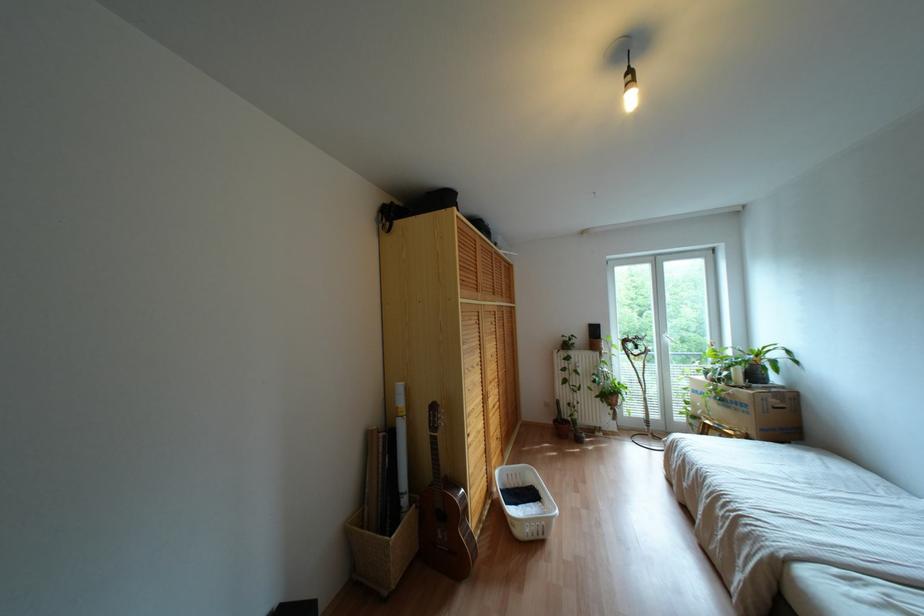
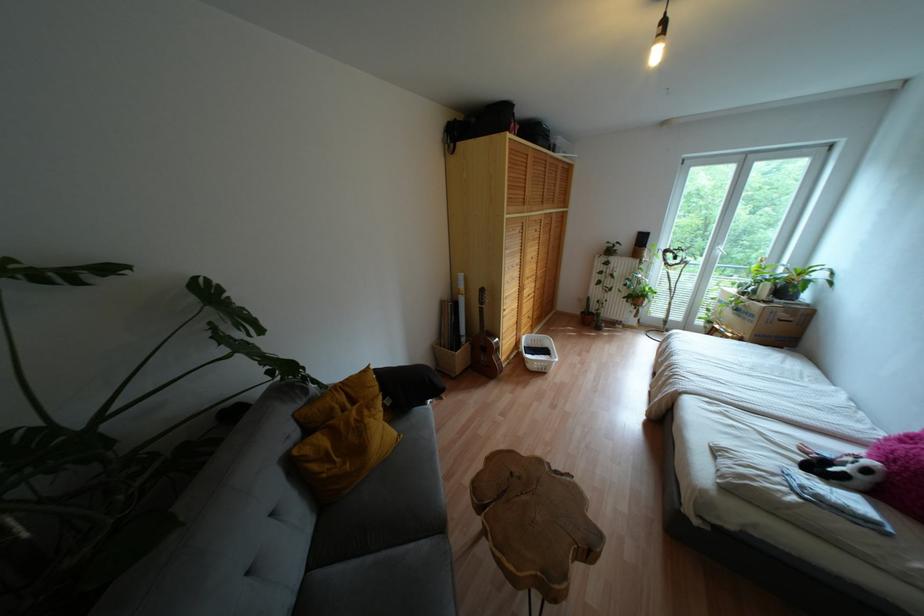
Find the pixel in the second image that matches point 727,407 in the first image.

(737, 315)